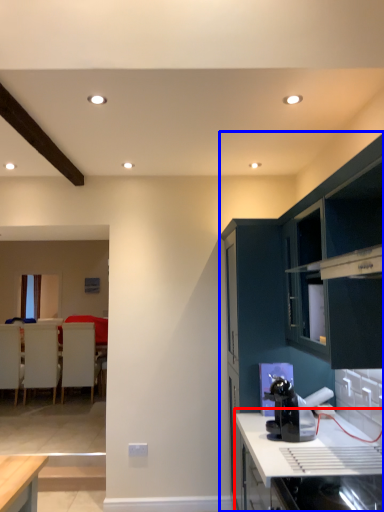
Question: Which point is further to the camera, countertop (highlighted by a red box) or cabinetry (highlighted by a blue box)?

Choices:
 (A) countertop
 (B) cabinetry

Answer: (B)